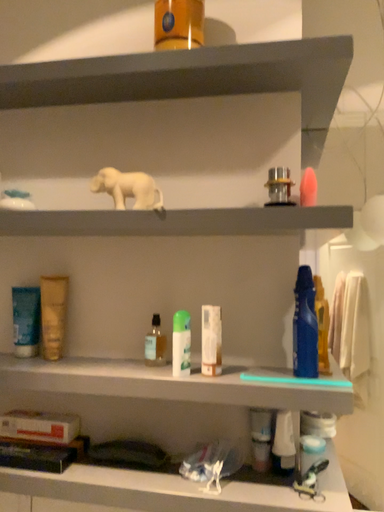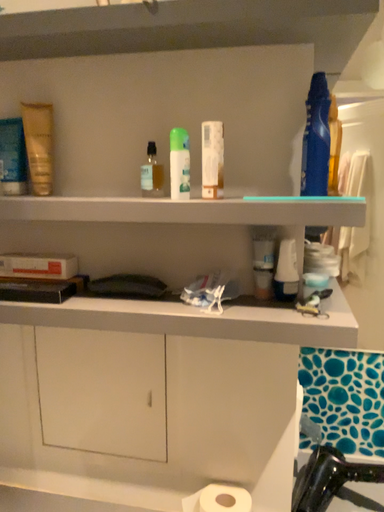
Question: How did the camera likely rotate when shooting the video?

Choices:
 (A) rotated upward
 (B) rotated downward

Answer: (B)